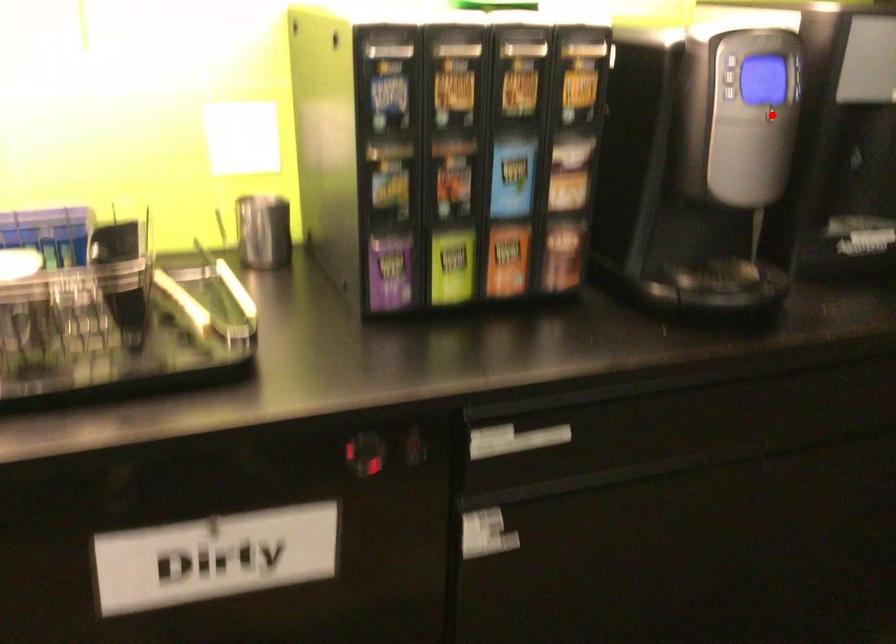
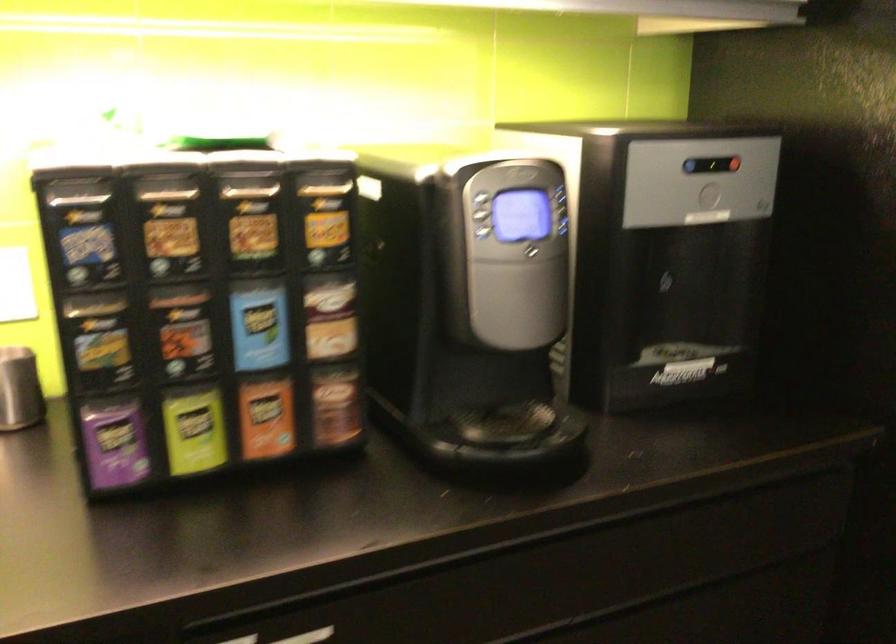
Locate, in the second image, the point that corresponds to the highlighted location in the first image.

(533, 252)